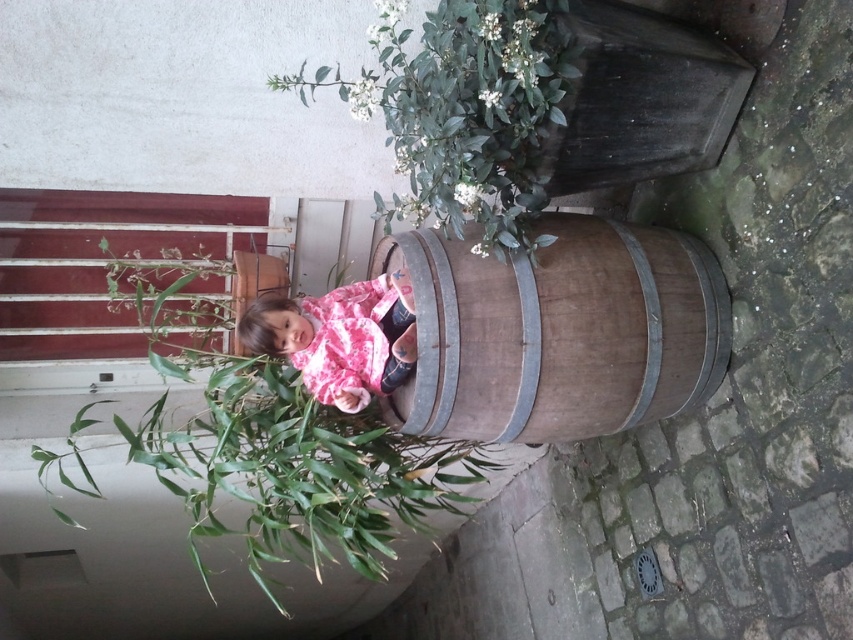
Does brown wooden barrel at center have a lesser width compared to pink cotton shirt at center?

Answer: No.

In order to click on brown wooden barrel at center in this screenshot , I will do (x=560, y=332).

The height and width of the screenshot is (640, 853). I want to click on brown wooden barrel at center, so click(x=560, y=332).

Can you confirm if brown wooden barrel at center is thinner than green leafy plant at upper center?

In fact, brown wooden barrel at center might be wider than green leafy plant at upper center.

Does brown wooden barrel at center lie behind green leafy plant at upper center?

Yes, brown wooden barrel at center is further from the viewer.

Identify the location of brown wooden barrel at center. Image resolution: width=853 pixels, height=640 pixels. (560, 332).

At what (x,y) coordinates should I click in order to perform the action: click on brown wooden barrel at center. Please return your answer as a coordinate pair (x, y). The image size is (853, 640). Looking at the image, I should click on (560, 332).

Can you confirm if green leafy plant at upper center is positioned to the left of pink cotton shirt at center?

No, green leafy plant at upper center is not to the left of pink cotton shirt at center.

Does green leafy plant at upper center have a greater height compared to pink cotton shirt at center?

Yes, green leafy plant at upper center is taller than pink cotton shirt at center.

Between point (457, 54) and point (346, 292), which one is positioned behind?

The point (346, 292) is more distant.

Where is `green leafy plant at upper center`? The height and width of the screenshot is (640, 853). green leafy plant at upper center is located at coordinates pyautogui.click(x=463, y=112).